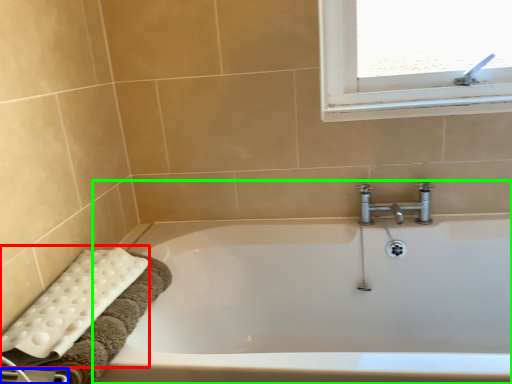
Question: Estimate the real-world distances between objects in this image. Which object is farther from bath towel (highlighted by a red box), towel bar (highlighted by a blue box) or bathtub (highlighted by a green box)?

Choices:
 (A) towel bar
 (B) bathtub

Answer: (B)